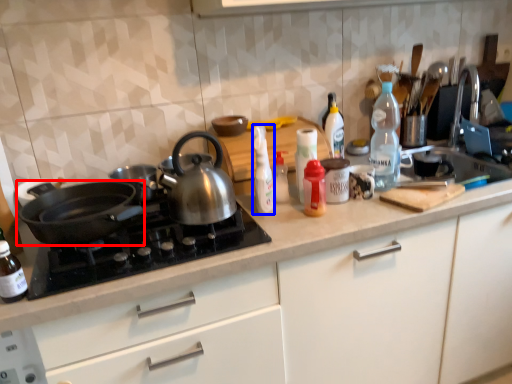
Question: Which object appears closest to the camera in this image, kitchen appliance (highlighted by a red box) or bottle (highlighted by a blue box)?

Choices:
 (A) kitchen appliance
 (B) bottle

Answer: (A)